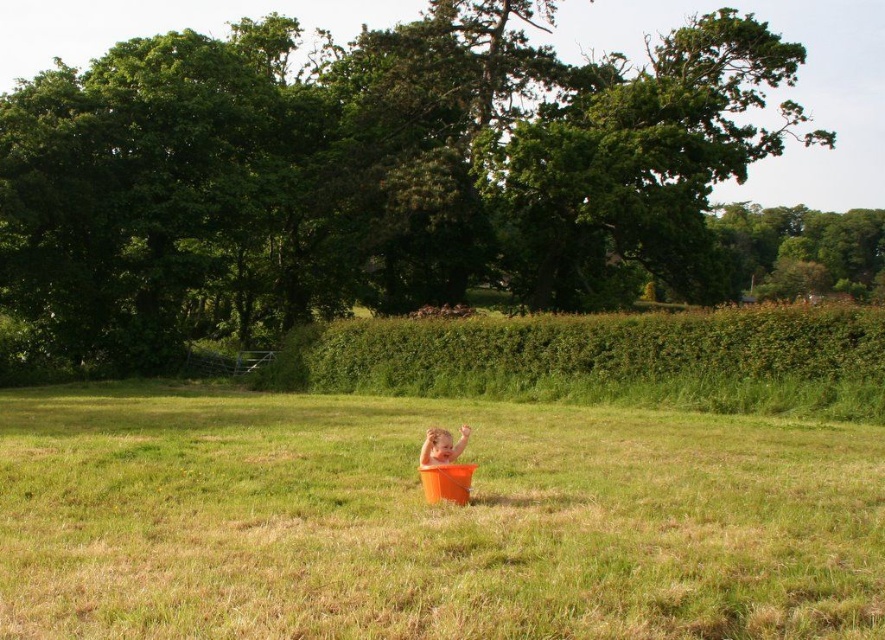
Does point (748, 632) come closer to viewer compared to point (435, 428)?

That is True.

Is orange matte bucket at center positioned behind smooth orange bucket at center?

No, orange matte bucket at center is in front of smooth orange bucket at center.

Is point (807, 557) positioned behind point (419, 452)?

No, it is in front of (419, 452).

Find the location of a particular element. The image size is (885, 640). orange matte bucket at center is located at coordinates (428, 518).

Which is more to the left, green leafy hedge at center or smooth orange bucket at center?

Positioned to the left is smooth orange bucket at center.

Is green leafy hedge at center to the right of smooth orange bucket at center from the viewer's perspective?

Yes, green leafy hedge at center is to the right of smooth orange bucket at center.

Between point (794, 365) and point (419, 452), which one is positioned behind?

Point (794, 365)

In order to click on green leafy hedge at center in this screenshot , I will do `click(606, 358)`.

Is point (806, 496) less distant than point (304, 326)?

That is True.

The height and width of the screenshot is (640, 885). Identify the location of orange matte bucket at center. (428, 518).

Does point (366, 561) come closer to viewer compared to point (793, 353)?

That is True.

Image resolution: width=885 pixels, height=640 pixels. I want to click on orange matte bucket at center, so click(x=428, y=518).